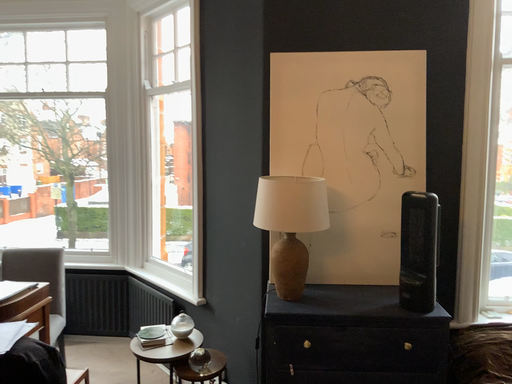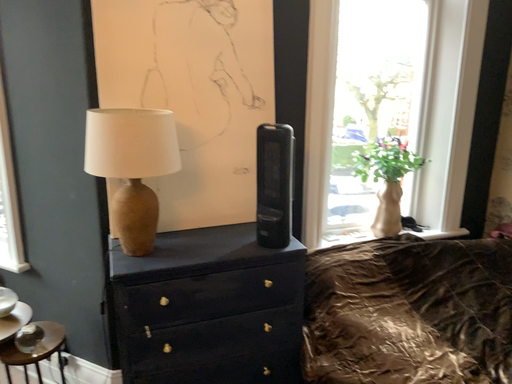
Question: How did the camera likely rotate when shooting the video?

Choices:
 (A) rotated right
 (B) rotated left

Answer: (A)